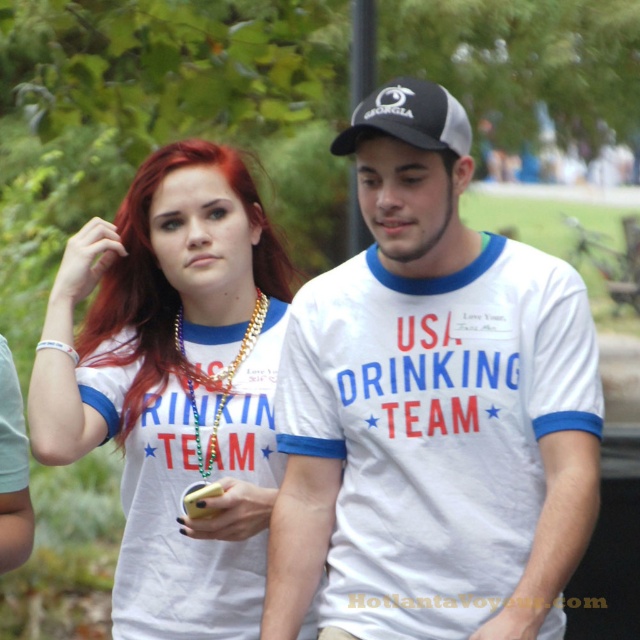
Does white matte t-shirt at center lie in front of gold chain necklace at center?

That is True.

Can you confirm if white matte t-shirt at center is positioned above gold chain necklace at center?

Incorrect, white matte t-shirt at center is not positioned above gold chain necklace at center.

This screenshot has width=640, height=640. Describe the element at coordinates (172, 385) in the screenshot. I see `white matte t-shirt at center` at that location.

Where is `white matte t-shirt at center`? The image size is (640, 640). white matte t-shirt at center is located at coordinates (172, 385).

Does black mesh cap at upper center appear on the left side of gold chain necklace at center?

No, black mesh cap at upper center is not to the left of gold chain necklace at center.

Which is more to the right, black mesh cap at upper center or gold chain necklace at center?

black mesh cap at upper center is more to the right.

Between point (468, 148) and point (241, 348), which one is positioned in front?

Point (468, 148) is more forward.

Where is `black mesh cap at upper center`? The image size is (640, 640). black mesh cap at upper center is located at coordinates (410, 116).

Is white matte t-shirt at center to the left of black mesh cap at upper center from the viewer's perspective?

Correct, you'll find white matte t-shirt at center to the left of black mesh cap at upper center.

Locate an element on the screen. This screenshot has width=640, height=640. white matte t-shirt at center is located at coordinates (172, 385).

Where is `white matte t-shirt at center`? The width and height of the screenshot is (640, 640). white matte t-shirt at center is located at coordinates (172, 385).

You are a GUI agent. You are given a task and a screenshot of the screen. Output one action in this format:
    pyautogui.click(x=<x>, y=<y>)
    Task: Click on the white matte t-shirt at center
    
    Given the screenshot: What is the action you would take?
    (x=172, y=385)